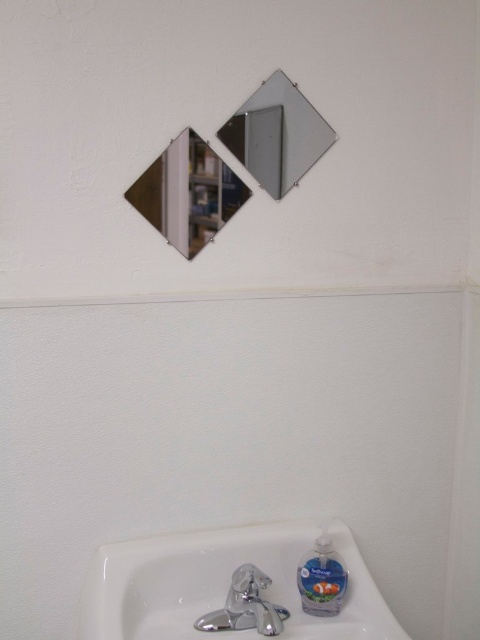
Question: Where is white glossy sink at lower center located in relation to clear glass mirror at upper center in the image?

Choices:
 (A) above
 (B) below

Answer: (B)

Question: Among these objects, which one is farthest from the camera?

Choices:
 (A) white glossy sink at lower center
 (B) silver metallic mirror at upper center

Answer: (B)

Question: Estimate the real-world distances between objects in this image. Which object is farther from the translucent plastic soap at lower right?

Choices:
 (A) silver metallic mirror at upper center
 (B) clear glass mirror at upper center
 (C) chrome metallic faucet at lower center

Answer: (A)

Question: Based on their relative distances, which object is nearer to the translucent plastic soap at lower right?

Choices:
 (A) silver metallic mirror at upper center
 (B) chrome metallic faucet at lower center
 (C) white glossy sink at lower center
 (D) clear glass mirror at upper center

Answer: (B)

Question: Does white glossy sink at lower center come behind translucent plastic soap at lower right?

Choices:
 (A) no
 (B) yes

Answer: (A)

Question: Can you confirm if clear glass mirror at upper center is positioned below silver metallic mirror at upper center?

Choices:
 (A) yes
 (B) no

Answer: (A)